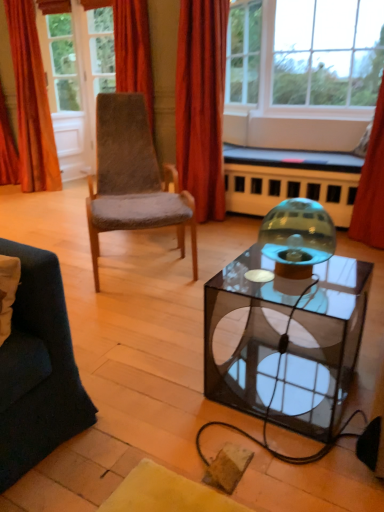
Locate an element on the screen. This screenshot has height=512, width=384. vacant area situated to the left side of transparent glass table at center is located at coordinates (178, 394).